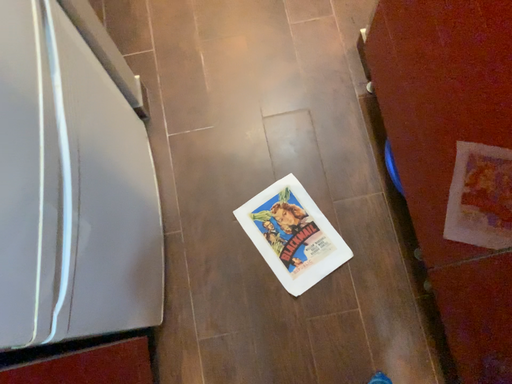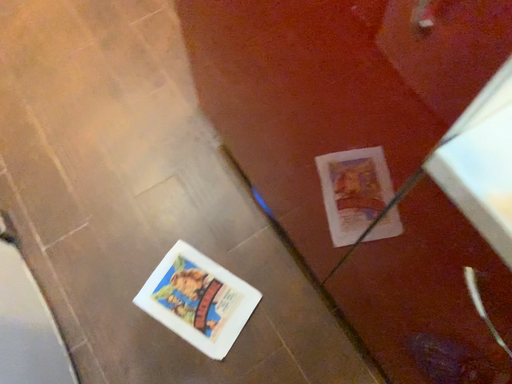
Question: Which way did the camera rotate in the video?

Choices:
 (A) rotated left
 (B) rotated right

Answer: (B)